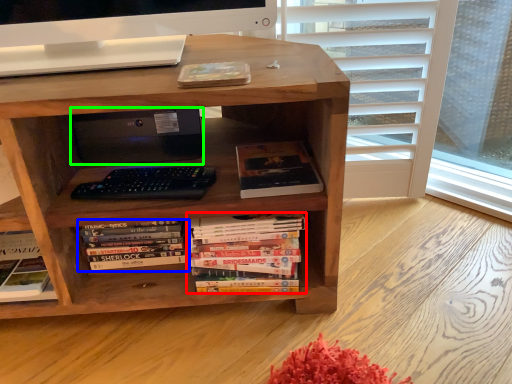
Question: Estimate the real-world distances between objects in this image. Which object is farther from book (highlighted by a red box), book (highlighted by a blue box) or computer (highlighted by a green box)?

Choices:
 (A) book
 (B) computer

Answer: (B)